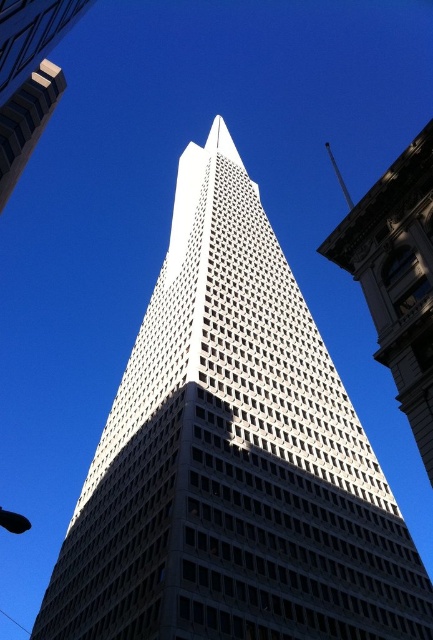
Question: Which of the following is the closest to the observer?

Choices:
 (A) (396, 160)
 (B) (7, 67)

Answer: (B)

Question: Is white glass skyscraper at center positioned at the back of white glass skyscraper at upper left?

Choices:
 (A) no
 (B) yes

Answer: (A)

Question: Among these objects, which one is nearest to the camera?

Choices:
 (A) white glass skyscraper at upper left
 (B) white glass skyscraper at center

Answer: (B)

Question: Is the position of white glass skyscraper at center more distant than that of white glass skyscraper at upper left?

Choices:
 (A) no
 (B) yes

Answer: (A)

Question: Is white glass skyscraper at center above white glass skyscraper at upper left?

Choices:
 (A) no
 (B) yes

Answer: (B)